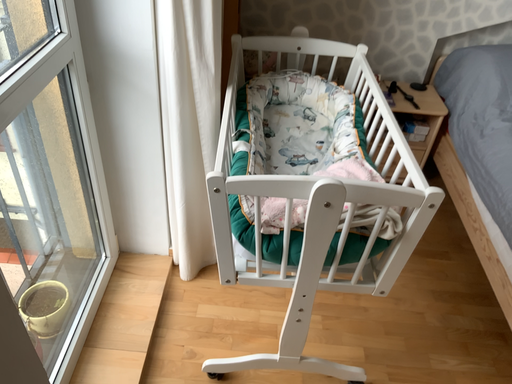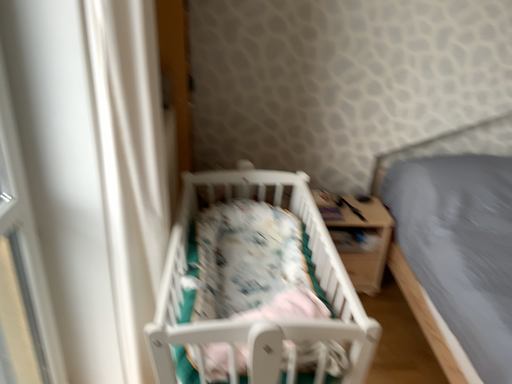
Question: Which way did the camera rotate in the video?

Choices:
 (A) rotated downward
 (B) rotated upward

Answer: (B)